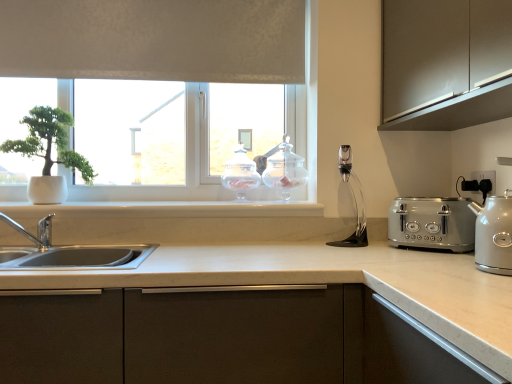
Question: In which direction should I rotate to look at clear glass jar at upper center, which is the second appliance in left-to-right order?

Choices:
 (A) right
 (B) left

Answer: (A)

Question: Is satin silver toaster at right not close to white marble window sill at center?

Choices:
 (A) yes
 (B) no

Answer: (B)

Question: From a real-world perspective, does satin silver toaster at right sit lower than white marble window sill at center?

Choices:
 (A) no
 (B) yes

Answer: (B)

Question: Does satin silver toaster at right have a lesser width compared to white marble window sill at center?

Choices:
 (A) no
 (B) yes

Answer: (B)

Question: Is satin silver toaster at right at the right side of white marble window sill at center?

Choices:
 (A) no
 (B) yes

Answer: (B)

Question: Considering the relative sizes of satin silver toaster at right and white marble window sill at center in the image provided, is satin silver toaster at right bigger than white marble window sill at center?

Choices:
 (A) no
 (B) yes

Answer: (A)

Question: Is satin silver toaster at right smaller than white marble window sill at center?

Choices:
 (A) no
 (B) yes

Answer: (B)

Question: Is satin silver kettle at right behind clear glass jar at center, acting as the first appliance starting from the left?

Choices:
 (A) no
 (B) yes

Answer: (A)

Question: Is satin silver kettle at right oriented towards clear glass jar at center, acting as the first appliance starting from the left?

Choices:
 (A) yes
 (B) no

Answer: (B)

Question: From a real-world perspective, is satin silver kettle at right beneath clear glass jar at center, acting as the first appliance starting from the left?

Choices:
 (A) yes
 (B) no

Answer: (A)

Question: Can you confirm if satin silver kettle at right is bigger than clear glass jar at center, arranged as the second appliance when viewed from the right?

Choices:
 (A) yes
 (B) no

Answer: (A)

Question: Considering the relative sizes of satin silver kettle at right and clear glass jar at center, acting as the first appliance starting from the left, in the image provided, is satin silver kettle at right thinner than clear glass jar at center, acting as the first appliance starting from the left,?

Choices:
 (A) no
 (B) yes

Answer: (A)

Question: Is clear glass jar at center, arranged as the second appliance when viewed from the right, surrounded by satin silver kettle at right?

Choices:
 (A) yes
 (B) no

Answer: (B)

Question: Considering the relative sizes of satin silver kettle at right and white matte window at upper center in the image provided, is satin silver kettle at right shorter than white matte window at upper center?

Choices:
 (A) yes
 (B) no

Answer: (A)